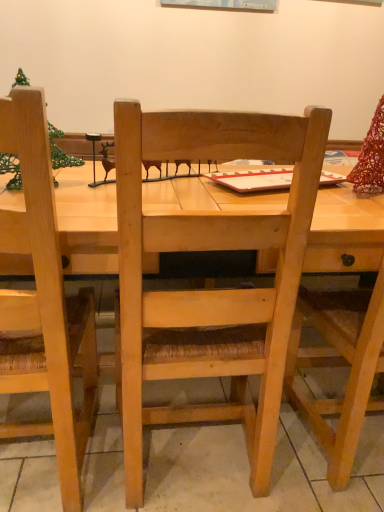
Locate an element on the screen. Image resolution: width=384 pixels, height=512 pixels. natural wood chair at left, marked as the second chair in a right-to-left arrangement is located at coordinates (44, 302).

This screenshot has width=384, height=512. What do you see at coordinates (44, 302) in the screenshot?
I see `natural wood chair at left, which is the 1th chair in left-to-right order` at bounding box center [44, 302].

What is the approximate width of natural wood chair at left, marked as the second chair in a right-to-left arrangement?

It is 18.46 inches.

Describe the element at coordinates (213, 290) in the screenshot. I see `natural wood chair at center, the first chair when ordered from right to left` at that location.

Where is `natural wood chair at center, the first chair when ordered from right to left`? This screenshot has height=512, width=384. natural wood chair at center, the first chair when ordered from right to left is located at coordinates (213, 290).

Identify the location of natural wood chair at left, which is the 1th chair in left-to-right order. (44, 302).

Consider the image. Between natural wood chair at center, the first chair when ordered from right to left, and natural wood chair at left, marked as the second chair in a right-to-left arrangement, which one appears on the left side from the viewer's perspective?

→ Positioned to the left is natural wood chair at left, marked as the second chair in a right-to-left arrangement.

Is the position of natural wood chair at center, the first chair when ordered from right to left, less distant than that of natural wood chair at left, marked as the second chair in a right-to-left arrangement?

No, it is behind natural wood chair at left, marked as the second chair in a right-to-left arrangement.

Which is behind, point (278, 378) or point (23, 161)?

The point (278, 378) is more distant.

From the image's perspective, is natural wood chair at center, the first chair when ordered from right to left, on top of natural wood chair at left, marked as the second chair in a right-to-left arrangement?

Correct, natural wood chair at center, the first chair when ordered from right to left, appears higher than natural wood chair at left, marked as the second chair in a right-to-left arrangement, in the image.

From a real-world perspective, who is located lower, natural wood chair at center, positioned as the second chair in left-to-right order, or natural wood chair at left, marked as the second chair in a right-to-left arrangement?

natural wood chair at center, positioned as the second chair in left-to-right order, is physically lower.

Which object is wider, natural wood chair at center, positioned as the second chair in left-to-right order, or natural wood chair at left, which is the 1th chair in left-to-right order?

With larger width is natural wood chair at center, positioned as the second chair in left-to-right order.

Looking at this image, between natural wood chair at center, positioned as the second chair in left-to-right order, and natural wood chair at left, which is the 1th chair in left-to-right order, which one has more height?

natural wood chair at left, which is the 1th chair in left-to-right order, is taller.

Considering the sizes of natural wood chair at center, the first chair when ordered from right to left, and natural wood chair at left, marked as the second chair in a right-to-left arrangement, in the image, is natural wood chair at center, the first chair when ordered from right to left, bigger or smaller than natural wood chair at left, marked as the second chair in a right-to-left arrangement,?

Considering their sizes, natural wood chair at center, the first chair when ordered from right to left, takes up more space than natural wood chair at left, marked as the second chair in a right-to-left arrangement.

Is natural wood chair at center, the first chair when ordered from right to left, inside the boundaries of natural wood chair at left, which is the 1th chair in left-to-right order, or outside?

natural wood chair at center, the first chair when ordered from right to left, cannot be found inside natural wood chair at left, which is the 1th chair in left-to-right order.

Is natural wood chair at center, the first chair when ordered from right to left, touching natural wood chair at left, marked as the second chair in a right-to-left arrangement?

No, natural wood chair at center, the first chair when ordered from right to left, is not next to natural wood chair at left, marked as the second chair in a right-to-left arrangement.

Is natural wood chair at center, positioned as the second chair in left-to-right order, oriented away from natural wood chair at left, which is the 1th chair in left-to-right order?

natural wood chair at center, positioned as the second chair in left-to-right order, does not have its back to natural wood chair at left, which is the 1th chair in left-to-right order.

Based on the photo, how distant is natural wood chair at center, the first chair when ordered from right to left, from natural wood chair at left, which is the 1th chair in left-to-right order?

natural wood chair at center, the first chair when ordered from right to left, is 11.57 inches away from natural wood chair at left, which is the 1th chair in left-to-right order.

Find the location of a particular element. The height and width of the screenshot is (512, 384). chair below the natural wood chair at center, the first chair when ordered from right to left (from the image's perspective) is located at coordinates (44, 302).

Between natural wood chair at left, marked as the second chair in a right-to-left arrangement, and natural wood chair at center, positioned as the second chair in left-to-right order, which one appears on the right side from the viewer's perspective?

From the viewer's perspective, natural wood chair at center, positioned as the second chair in left-to-right order, appears more on the right side.

Relative to natural wood chair at center, the first chair when ordered from right to left, is natural wood chair at left, marked as the second chair in a right-to-left arrangement, in front or behind?

natural wood chair at left, marked as the second chair in a right-to-left arrangement, is in front of natural wood chair at center, the first chair when ordered from right to left.

Which is behind, point (89, 422) or point (290, 311)?

The point (89, 422) is farther from the camera.

From the image's perspective, is natural wood chair at left, which is the 1th chair in left-to-right order, located above or below natural wood chair at center, positioned as the second chair in left-to-right order?

natural wood chair at left, which is the 1th chair in left-to-right order, is situated lower than natural wood chair at center, positioned as the second chair in left-to-right order, in the image.

From a real-world perspective, does natural wood chair at left, which is the 1th chair in left-to-right order, sit lower than natural wood chair at center, the first chair when ordered from right to left?

Incorrect, from a real-world perspective, natural wood chair at left, which is the 1th chair in left-to-right order, is higher than natural wood chair at center, the first chair when ordered from right to left.

Does natural wood chair at left, which is the 1th chair in left-to-right order, have a greater width compared to natural wood chair at center, the first chair when ordered from right to left?

In fact, natural wood chair at left, which is the 1th chair in left-to-right order, might be narrower than natural wood chair at center, the first chair when ordered from right to left.

Who is shorter, natural wood chair at left, marked as the second chair in a right-to-left arrangement, or natural wood chair at center, positioned as the second chair in left-to-right order?

With less height is natural wood chair at center, positioned as the second chair in left-to-right order.

Looking at this image, who is smaller, natural wood chair at left, which is the 1th chair in left-to-right order, or natural wood chair at center, the first chair when ordered from right to left?

With smaller size is natural wood chair at left, which is the 1th chair in left-to-right order.

Do you think natural wood chair at left, marked as the second chair in a right-to-left arrangement, is within natural wood chair at center, positioned as the second chair in left-to-right order, or outside of it?

natural wood chair at left, marked as the second chair in a right-to-left arrangement, is spatially positioned inside natural wood chair at center, positioned as the second chair in left-to-right order.

Are natural wood chair at left, which is the 1th chair in left-to-right order, and natural wood chair at center, the first chair when ordered from right to left, far apart?

natural wood chair at left, which is the 1th chair in left-to-right order, is actually quite close to natural wood chair at center, the first chair when ordered from right to left.

Is natural wood chair at left, marked as the second chair in a right-to-left arrangement, facing towards natural wood chair at center, the first chair when ordered from right to left?

Yes, natural wood chair at left, marked as the second chair in a right-to-left arrangement, is aimed at natural wood chair at center, the first chair when ordered from right to left.

The image size is (384, 512). There is a natural wood chair at center, the first chair when ordered from right to left. Identify the location of chair above it (from a real-world perspective). (44, 302).

Locate an element on the screen. chair on the right of natural wood chair at left, marked as the second chair in a right-to-left arrangement is located at coordinates (213, 290).

Where is `chair that appears below the natural wood chair at center, the first chair when ordered from right to left (from the image's perspective)`? The image size is (384, 512). chair that appears below the natural wood chair at center, the first chair when ordered from right to left (from the image's perspective) is located at coordinates (44, 302).